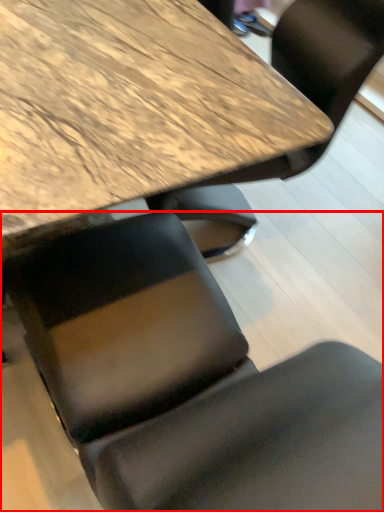
Question: In this image, where is chair (annotated by the red box) located relative to table?

Choices:
 (A) right
 (B) left

Answer: (A)